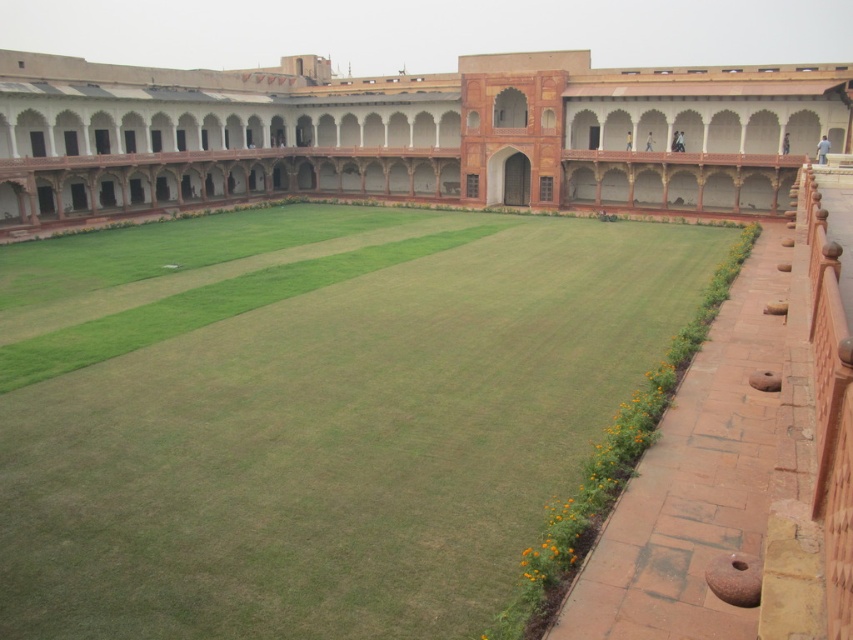
Which of these two, green grass at center or terracotta stone palace at center, stands taller?

terracotta stone palace at center

Find the location of a particular element. The width and height of the screenshot is (853, 640). green grass at center is located at coordinates (312, 413).

I want to click on green grass at center, so click(312, 413).